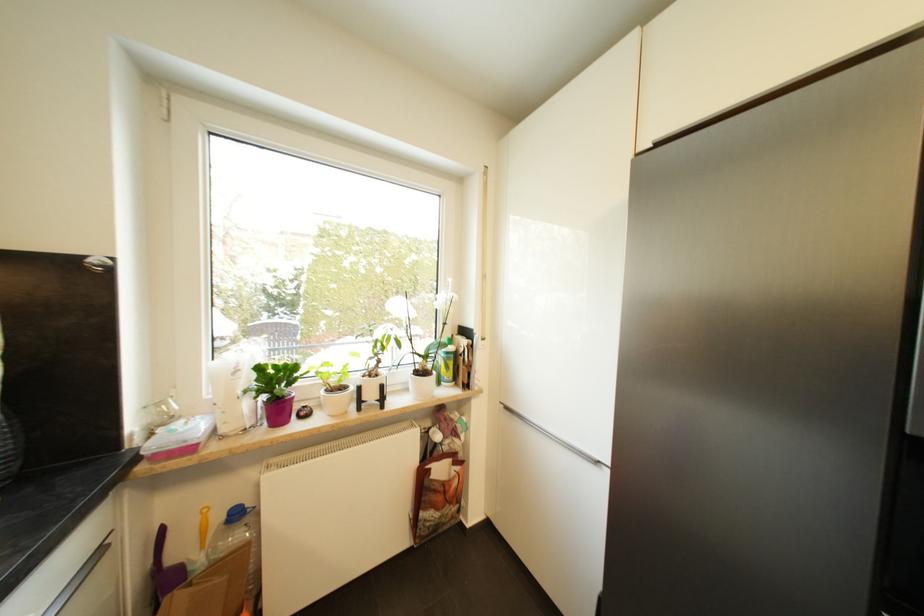
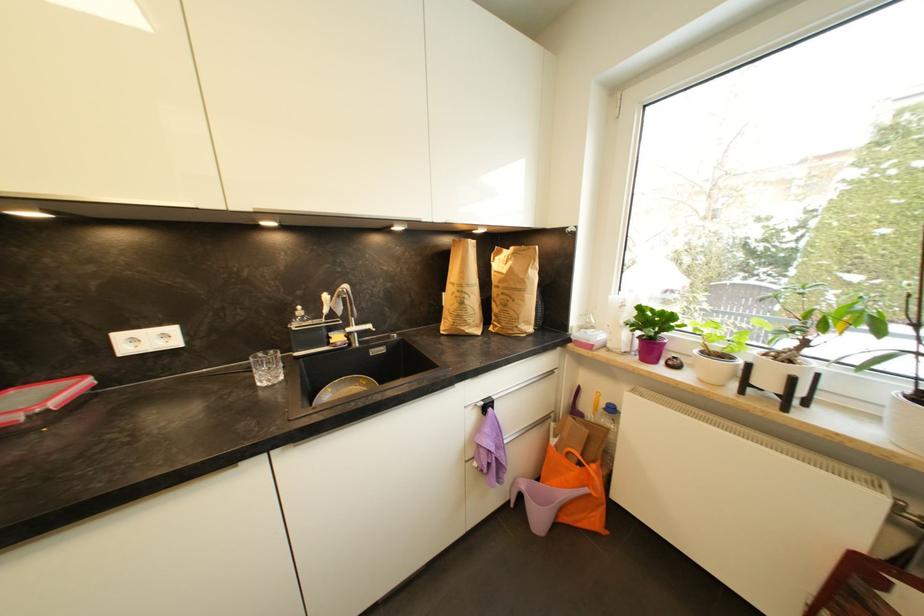
Question: The first image is from the beginning of the video and the second image is from the end. How did the camera likely rotate when shooting the video?

Choices:
 (A) Left
 (B) Right
 (C) Up
 (D) Down

Answer: (A)